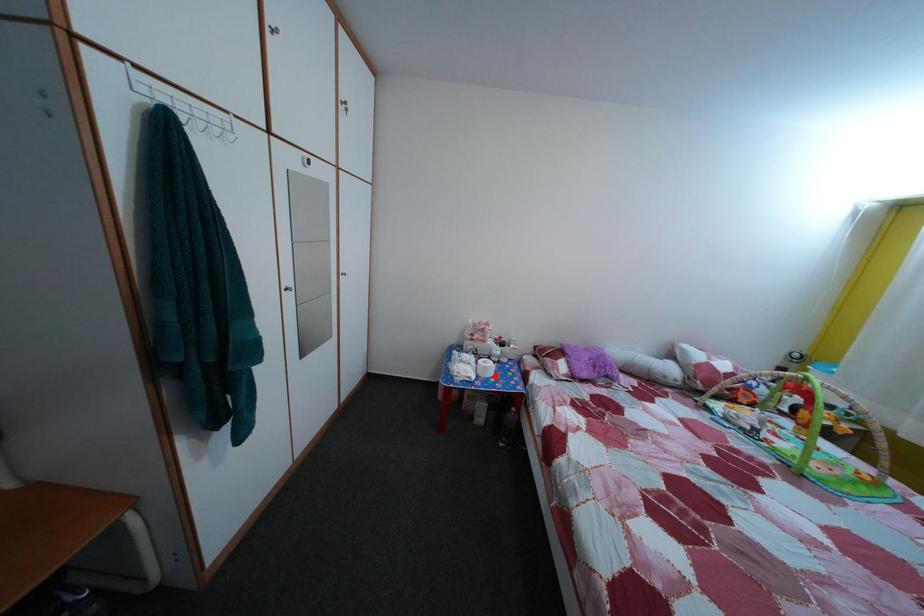
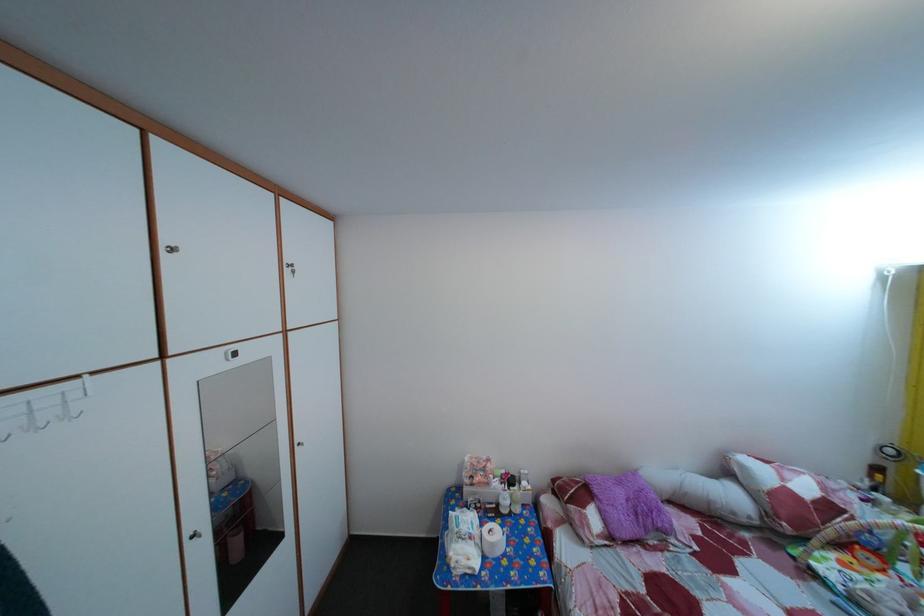
The point at the highlighted location is marked in the first image. Where is the corresponding point in the second image?

(502, 553)